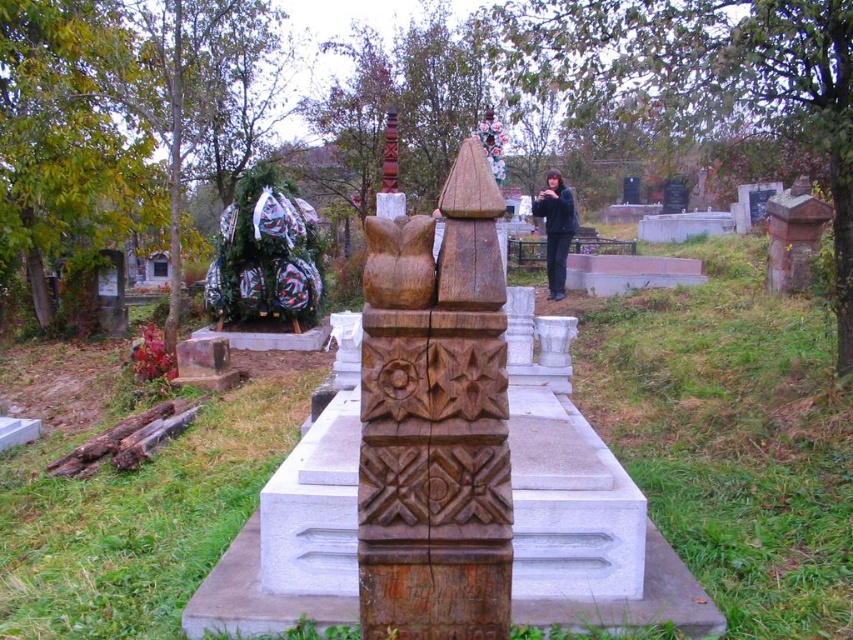
You are an artist visiting the cemetery and want to place a new sculpture between the green fabric sculpture at left and the black matte jacket at center. Based on their heights, which object should the new sculpture be taller than to ensure it stands out?

The green fabric sculpture at left is taller than the black matte jacket at center. To make the new sculpture stand out, it should be taller than the green fabric sculpture at left.

You are standing in the cemetery and want to place a small bouquet of flowers between the black matte jacket at center and the brown wood totem pole at center. Which object should you place the bouquet closer to if you want it to be closer to the viewer?

You should place the bouquet closer to the black matte jacket at center because it is closer to the viewer than the brown wood totem pole at center.

Consider the image. You are a photographer standing at the edge of the cemetery, aiming to capture a photo of the black matte jacket at center and the brown wood totem pole at center. Which object should you focus on first if you want to ensure both are in sharp focus, considering their sizes?

The black matte jacket at center is much taller than the brown wood totem pole at center. To ensure both are in sharp focus, focus on the black matte jacket at center first since it is larger and requires more attention to detail.